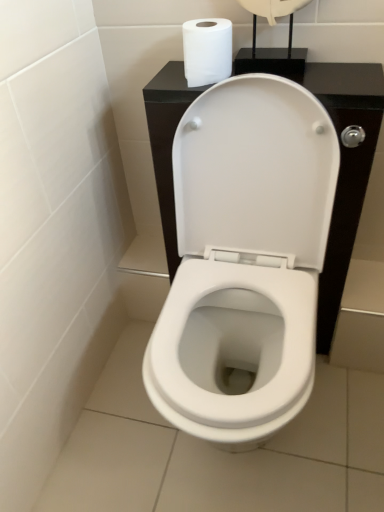
What is the approximate width of white matte toilet paper at upper center?

It is 7.03 inches.

Describe the element at coordinates (207, 51) in the screenshot. I see `white matte toilet paper at upper center` at that location.

This screenshot has width=384, height=512. What are the coordinates of `white matte toilet paper at upper center` in the screenshot? It's located at (207, 51).

At what (x,y) coordinates should I click in order to perform the action: click on white matte toilet paper at upper center. Please return your answer as a coordinate pair (x, y). The width and height of the screenshot is (384, 512). Looking at the image, I should click on (207, 51).